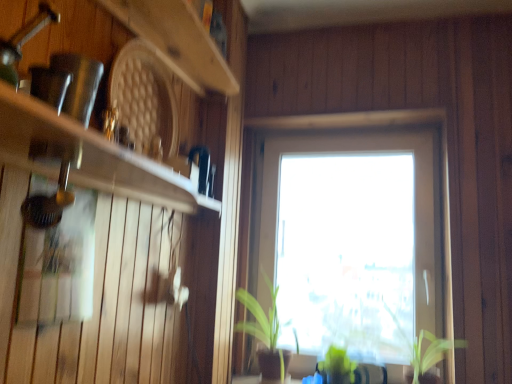
Identify the location of vacant point above wooden at upper left, which appears as the first shelf when viewed from the top (from a real-world perspective). (197, 55).